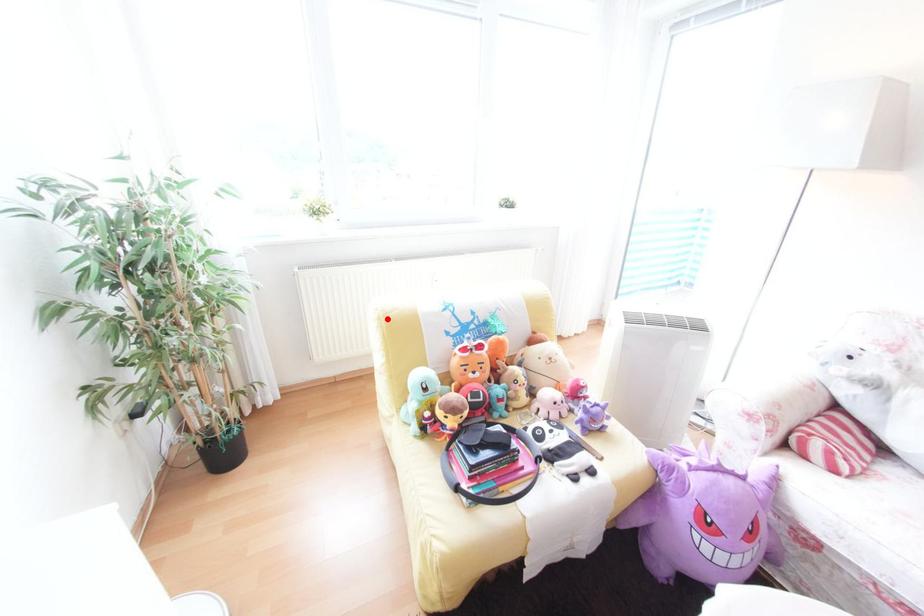
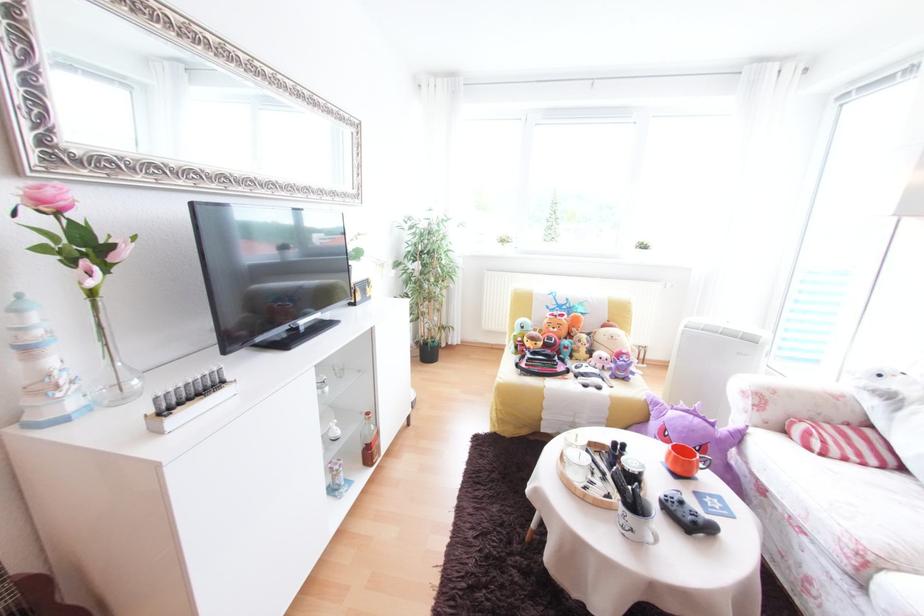
Where in the second image is the point corresponding to the highlighted location from the first image?

(520, 292)